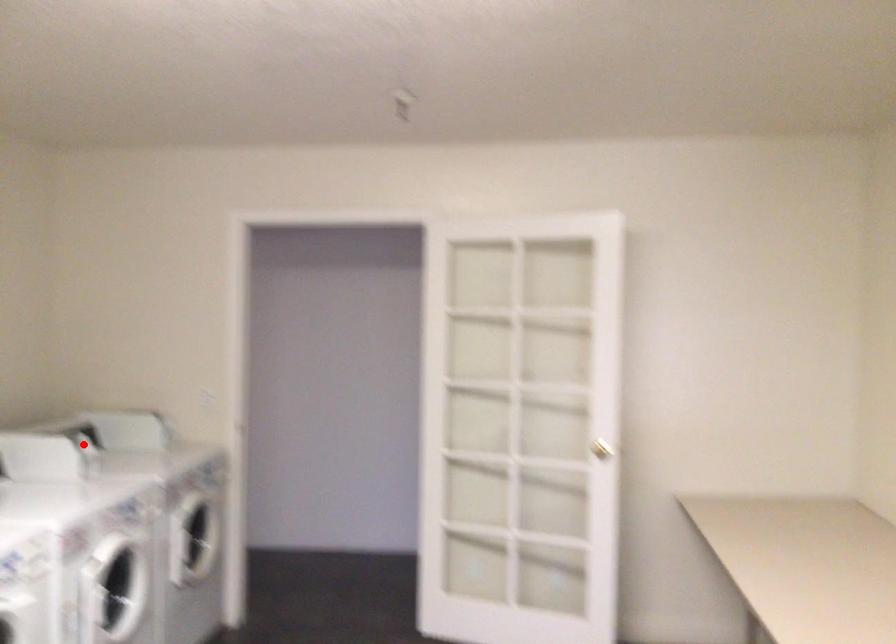
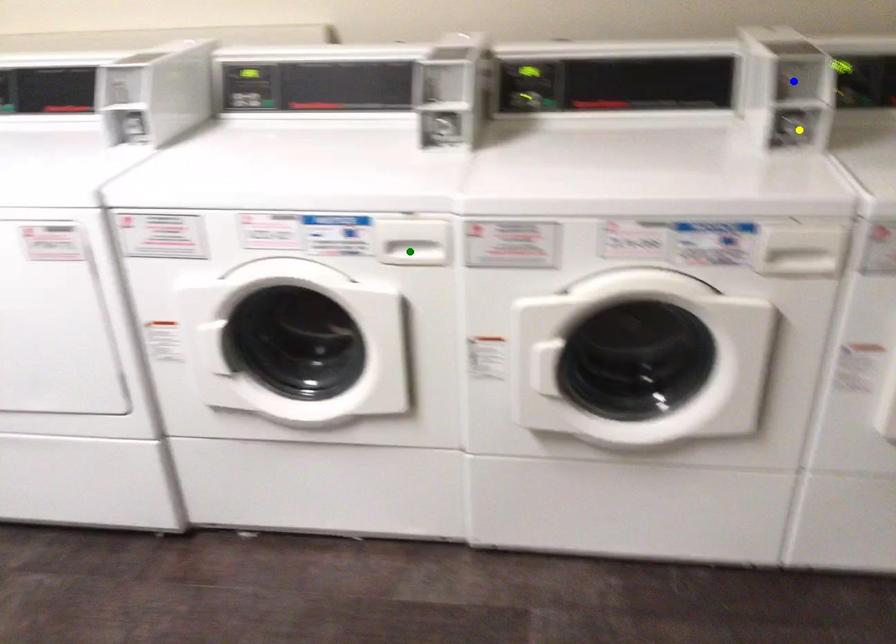
Question: I am providing you with two images of the same scene from different viewpoints. A red point is marked on the first image. You are given multiple points on the second image. Which point in image 2 is actually the same real-world point as the red point in image 1?

Choices:
 (A) blue point
 (B) yellow point
 (C) green point

Answer: (A)